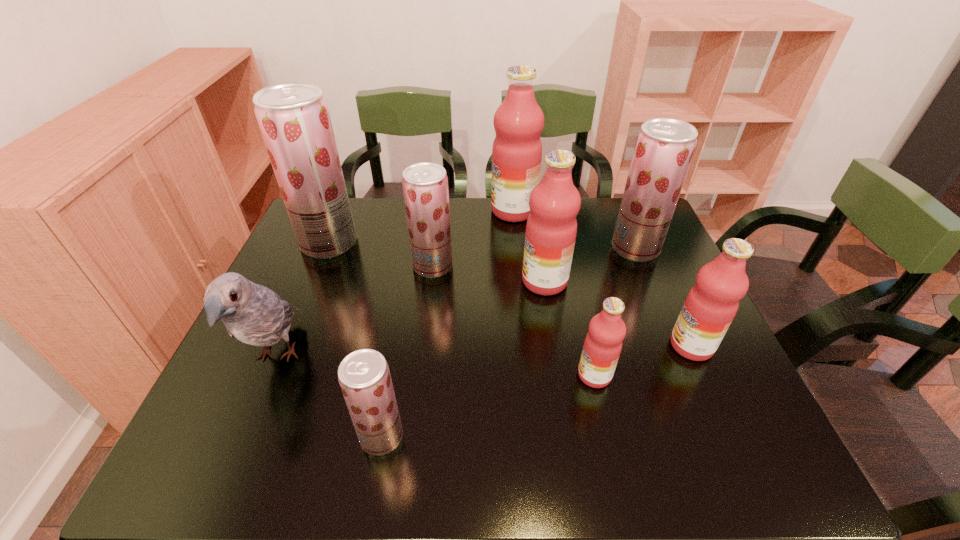
Where is `fruit juice that is the seventh closest to the gray parrot`? This screenshot has height=540, width=960. fruit juice that is the seventh closest to the gray parrot is located at coordinates (664, 148).

Identify which fruit juice is the closest to the nearest object. Please provide its 2D coordinates. Your answer should be formatted as a tuple, i.e. [(x, y)], where the tuple contains the x and y coordinates of a point satisfying the conditions above.

[(603, 343)]

Locate an element on the screen. This screenshot has height=540, width=960. the second closest pink fruit juice to the parrot is located at coordinates (518, 122).

This screenshot has height=540, width=960. I want to click on pink fruit juice that can be found as the closest to the third biggest strawberry fruit juice, so click(x=518, y=122).

Find the location of `the third closest strawberry fruit juice to the third biggest strawberry fruit juice`. the third closest strawberry fruit juice to the third biggest strawberry fruit juice is located at coordinates (664, 148).

Locate which strawberry fruit juice is the third closest to the rightmost pink fruit juice. Please provide its 2D coordinates. Your answer should be formatted as a tuple, i.e. [(x, y)], where the tuple contains the x and y coordinates of a point satisfying the conditions above.

[(364, 376)]

This screenshot has width=960, height=540. I want to click on vacant point that satisfies the following two spatial constraints: 1. on the front side of the leftmost strawberry fruit juice; 2. on the right side of the second smallest strawberry fruit juice, so click(x=320, y=266).

I want to click on vacant position in the image that satisfies the following two spatial constraints: 1. on the front side of the rightmost strawberry fruit juice; 2. on the label of the smallest pink fruit juice, so click(688, 375).